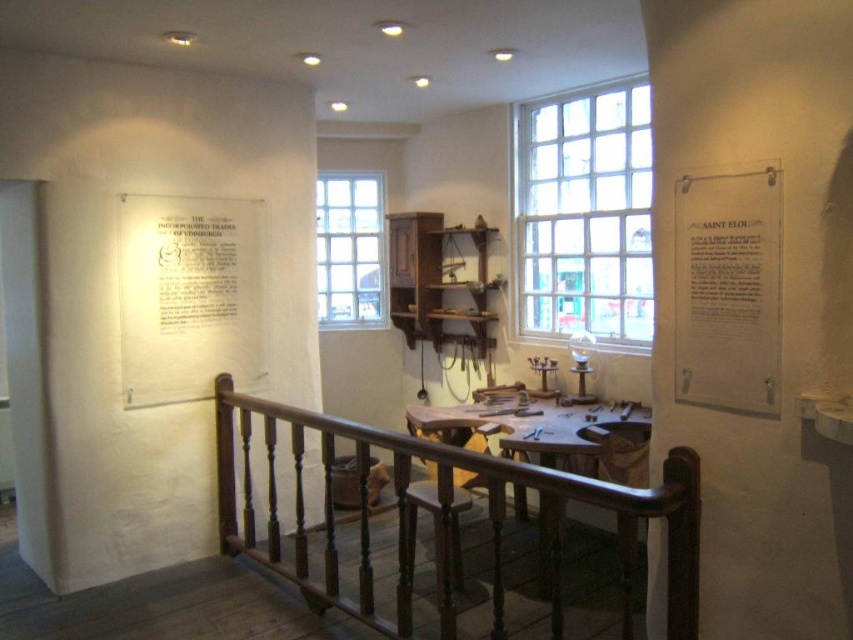
Looking at this image, between clear glass window at upper center and white paper at upper left, which one appears on the left side from the viewer's perspective?

white paper at upper left

Does clear glass window at upper center have a lesser height compared to white paper at upper left?

No, clear glass window at upper center is not shorter than white paper at upper left.

Who is more distant from viewer, (x=589, y=192) or (x=140, y=224)?

Point (x=589, y=192)

The width and height of the screenshot is (853, 640). What are the coordinates of `clear glass window at upper center` in the screenshot? It's located at (585, 212).

Is dark wood table at center thinner than clear glass window at center?

No, dark wood table at center is not thinner than clear glass window at center.

The height and width of the screenshot is (640, 853). What are the coordinates of `dark wood table at center` in the screenshot? It's located at (553, 435).

Where is `dark wood table at center`? dark wood table at center is located at coordinates (553, 435).

Based on the photo, can you confirm if clear glass window at upper center is positioned to the left of clear glass window at center?

Incorrect, clear glass window at upper center is not on the left side of clear glass window at center.

Can you confirm if clear glass window at upper center is positioned below clear glass window at center?

Actually, clear glass window at upper center is above clear glass window at center.

Who is more distant from viewer, (619, 104) or (357, 275)?

Point (357, 275)

This screenshot has width=853, height=640. I want to click on clear glass window at upper center, so (585, 212).